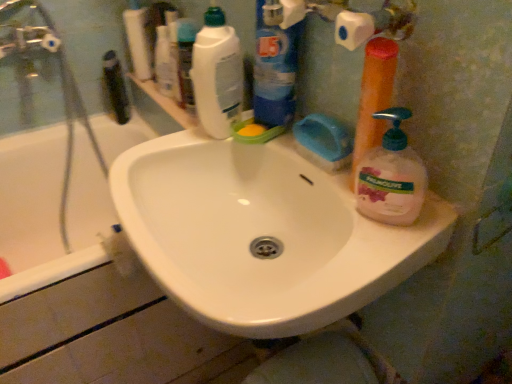
This screenshot has width=512, height=384. Identify the location of free spot in front of pink translucent liquid soap at right, arranged as the fourth cleaning product when viewed from the left. (373, 259).